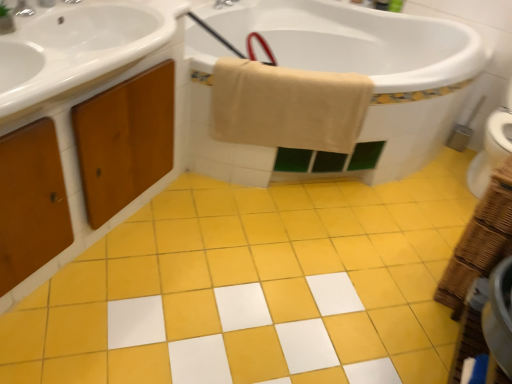
This screenshot has height=384, width=512. In order to click on free space in front of white glossy bathtub at upper center in this screenshot , I will do `click(247, 284)`.